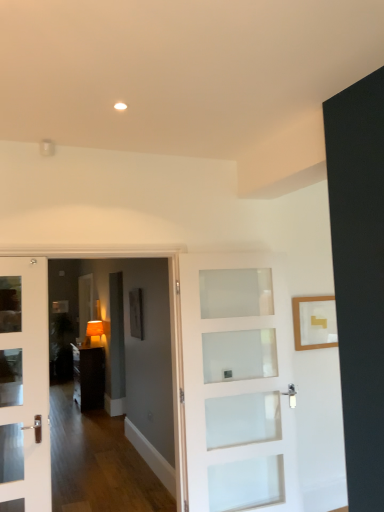
Question: Is white frosted glass door at center in contact with matte orange lampshade at center?

Choices:
 (A) yes
 (B) no

Answer: (B)

Question: Is white frosted glass door at center wider than matte orange lampshade at center?

Choices:
 (A) yes
 (B) no

Answer: (B)

Question: Is white frosted glass door at center at the right side of matte orange lampshade at center?

Choices:
 (A) no
 (B) yes

Answer: (B)

Question: Is white frosted glass door at center closer to camera compared to matte orange lampshade at center?

Choices:
 (A) yes
 (B) no

Answer: (A)

Question: Is white frosted glass door at center oriented towards matte orange lampshade at center?

Choices:
 (A) no
 (B) yes

Answer: (A)

Question: Can you confirm if white frosted glass door at center is bigger than matte orange lampshade at center?

Choices:
 (A) no
 (B) yes

Answer: (B)

Question: Is matte orange lampshade at center smaller than white frosted glass door at center?

Choices:
 (A) no
 (B) yes

Answer: (B)

Question: Is matte orange lampshade at center shorter than white frosted glass door at center?

Choices:
 (A) yes
 (B) no

Answer: (A)

Question: From the image's perspective, is matte orange lampshade at center located beneath white frosted glass door at center?

Choices:
 (A) no
 (B) yes

Answer: (B)

Question: From a real-world perspective, does matte orange lampshade at center sit lower than white frosted glass door at center?

Choices:
 (A) yes
 (B) no

Answer: (B)

Question: From the image's perspective, does matte orange lampshade at center appear higher than white frosted glass door at center?

Choices:
 (A) no
 (B) yes

Answer: (A)

Question: Is matte orange lampshade at center further to camera compared to white frosted glass door at center?

Choices:
 (A) no
 (B) yes

Answer: (B)

Question: Does white frosted glass door at center have a greater height compared to dark wood cabinet at center?

Choices:
 (A) yes
 (B) no

Answer: (A)